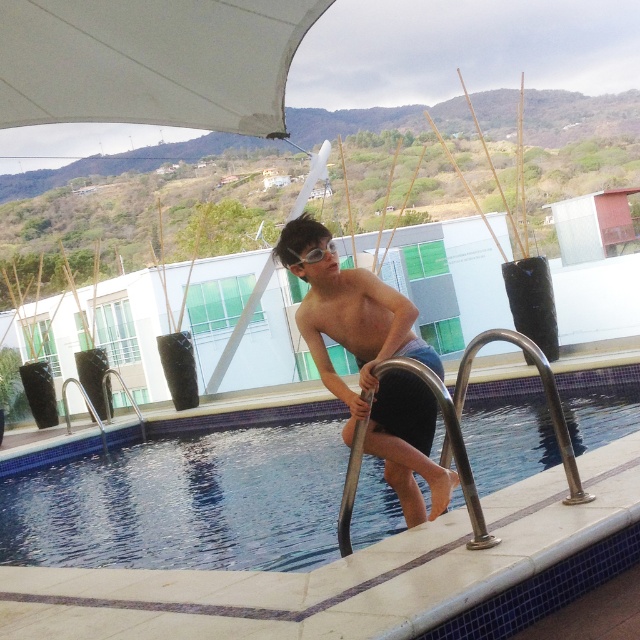
You are a lifeguard standing at the edge of the pool. You notice the blue glossy water at center and the clear plastic goggles at upper center. Which object is wider?

The blue glossy water at center is wider than the clear plastic goggles at upper center.

You are a lifeguard standing at the edge of the pool. You see the blue glossy water at center and the light blue denim shorts at center. Which one is located to the right side of the other?

The blue glossy water at center is positioned on the right side of light blue denim shorts at center.